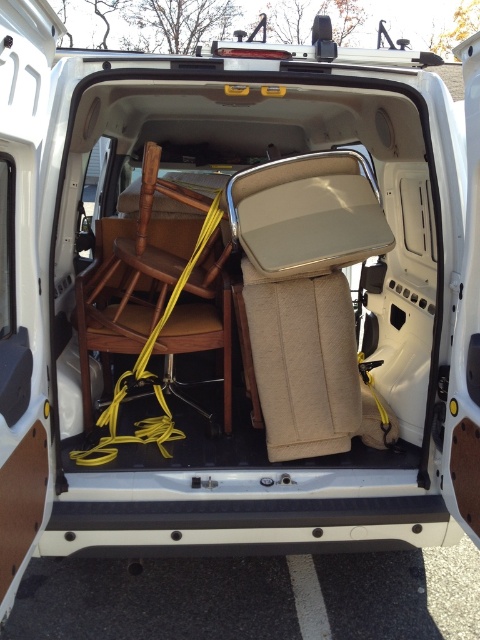
Can you confirm if beige fabric folding chair at center is bigger than wooden chair at center?

No, beige fabric folding chair at center is not bigger than wooden chair at center.

The width and height of the screenshot is (480, 640). I want to click on beige fabric folding chair at center, so click(x=309, y=298).

Measure the distance between beige fabric folding chair at center and camera.

The distance of beige fabric folding chair at center from camera is 2.26 meters.

Find the location of `beige fabric folding chair at center`. beige fabric folding chair at center is located at coordinates (309, 298).